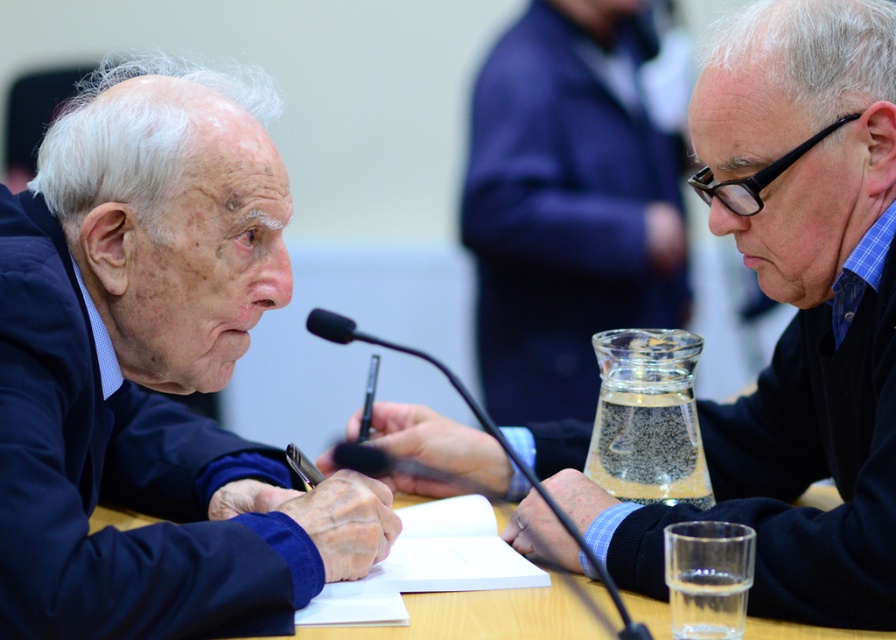
Question: Can you confirm if matte black suit at left is bigger than wooden table at center?

Choices:
 (A) yes
 (B) no

Answer: (A)

Question: Can you confirm if clear glass vase at center is positioned below wooden table at center?

Choices:
 (A) no
 (B) yes

Answer: (A)

Question: Is clear glass vase at center to the left of wooden table at center from the viewer's perspective?

Choices:
 (A) no
 (B) yes

Answer: (A)

Question: Which object is farther from the camera taking this photo?

Choices:
 (A) clear glass vase at center
 (B) matte black suit at left
 (C) wooden table at center

Answer: (A)

Question: Which point is closer to the camera?

Choices:
 (A) (662, 627)
 (B) (479, 435)

Answer: (A)

Question: Which of the following is the closest to the observer?

Choices:
 (A) click(x=797, y=88)
 (B) click(x=162, y=132)
 (C) click(x=520, y=339)

Answer: (B)